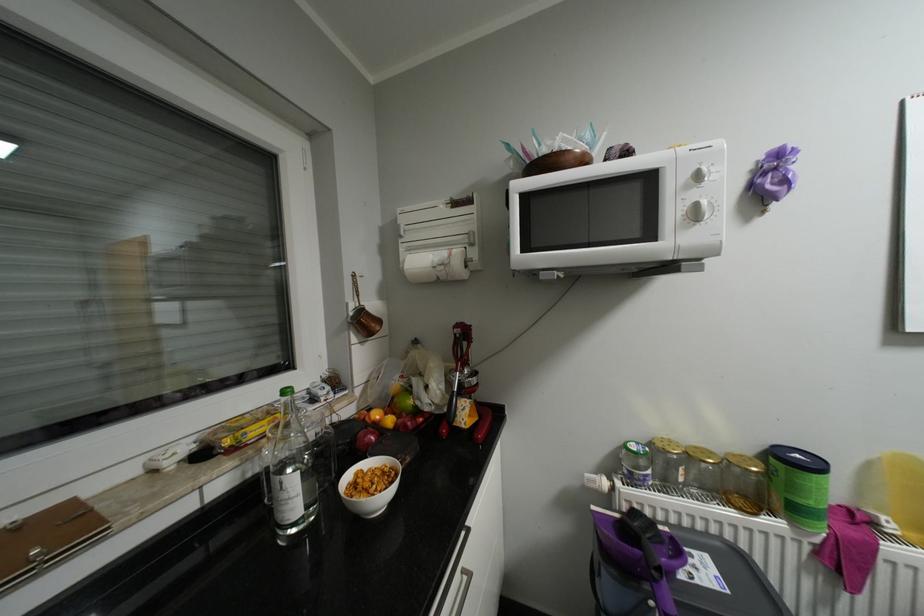
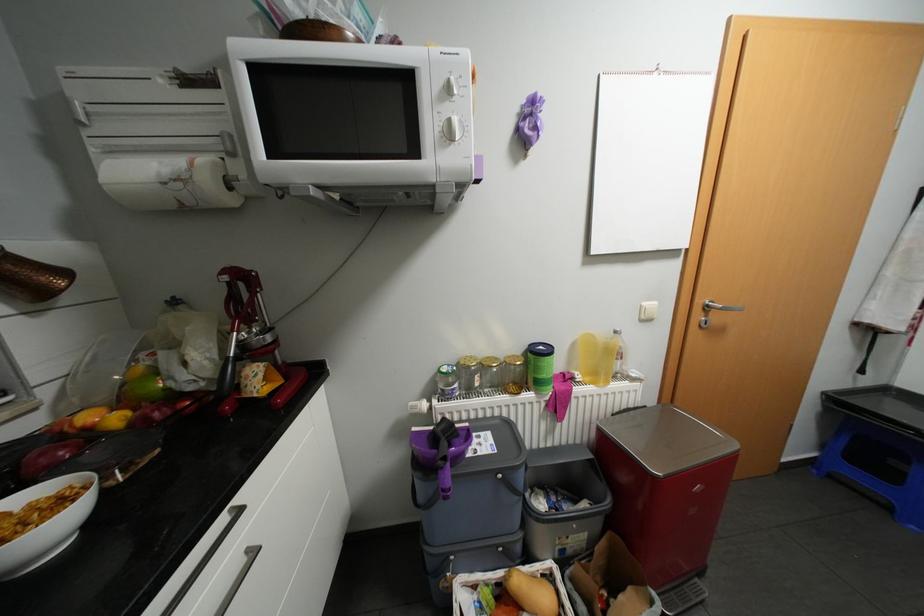
Question: The first image is from the beginning of the video and the second image is from the end. How did the camera likely rotate when shooting the video?

Choices:
 (A) Left
 (B) Right
 (C) Up
 (D) Down

Answer: (B)